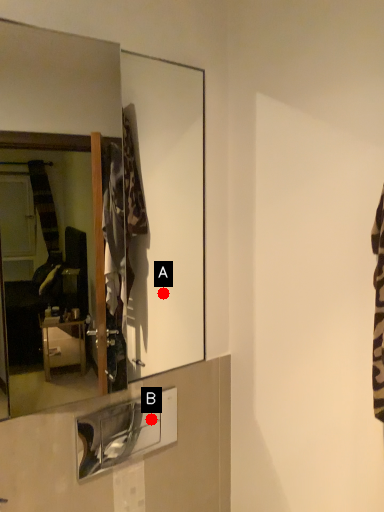
Question: Two points are circled on the image, labeled by A and B beside each circle. Which point appears farthest from the camera in this image?

Choices:
 (A) A is further
 (B) B is further

Answer: (B)